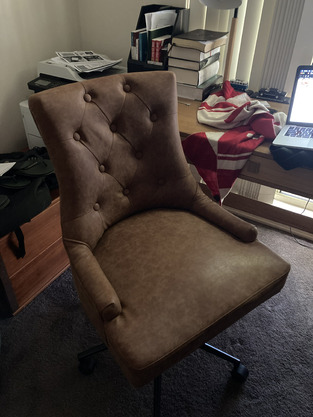
Identify the location of wall. This screenshot has height=417, width=313. (27, 45).